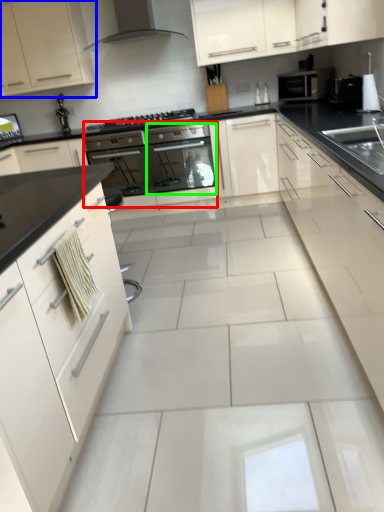
Question: Which is nearer to the oven (highlighted by a red box)? cabinetry (highlighted by a blue box) or oven (highlighted by a green box).

Choices:
 (A) cabinetry
 (B) oven

Answer: (B)